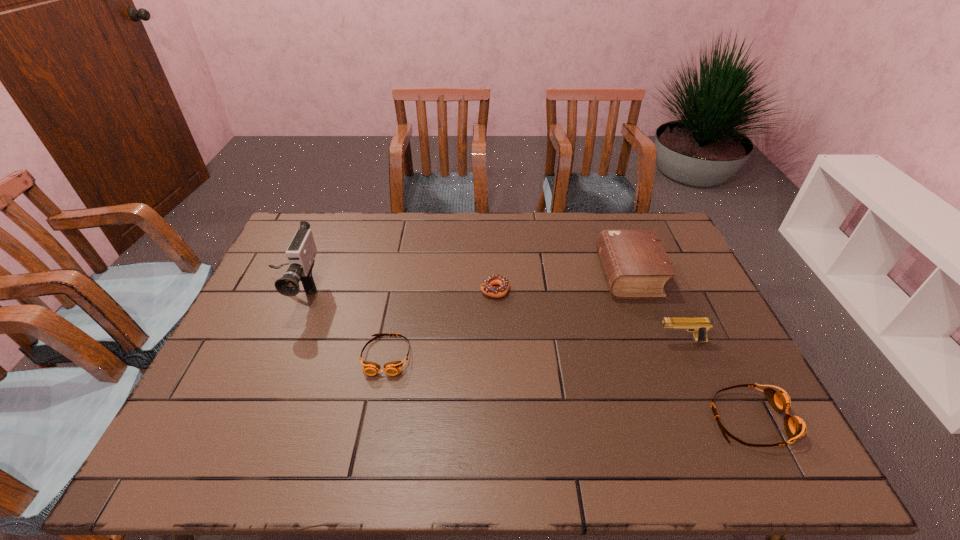
Where is `free space at the far left corner`? free space at the far left corner is located at coordinates (316, 218).

This screenshot has height=540, width=960. I want to click on vacant area at the near right corner, so click(703, 394).

I want to click on free space between the third object from left to right and the fourth tallest object, so click(623, 354).

Image resolution: width=960 pixels, height=540 pixels. I want to click on unoccupied area between the pistol and the third object from left to right, so click(588, 315).

You are a GUI agent. You are given a task and a screenshot of the screen. Output one action in this format:
    pyautogui.click(x=<x>, y=<y>)
    Task: Click on the vacant area that lies between the pistol and the Bible
    This screenshot has height=540, width=960.
    Given the screenshot: What is the action you would take?
    pyautogui.click(x=655, y=308)

Locate an element on the screen. This screenshot has width=960, height=540. vacant area between the right goggles and the pistol is located at coordinates (716, 380).

Where is `empty space between the pistol and the Bible`? Image resolution: width=960 pixels, height=540 pixels. empty space between the pistol and the Bible is located at coordinates (655, 308).

Find the location of a particular element. The width and height of the screenshot is (960, 540). vacant space that is in between the fourth tallest object and the third object from left to right is located at coordinates (623, 354).

Identify the location of blank region between the shorter goggles and the nearer goggles. tap(568, 387).

What are the coordinates of `free area in between the leftmost object and the pistol` in the screenshot? It's located at (487, 316).